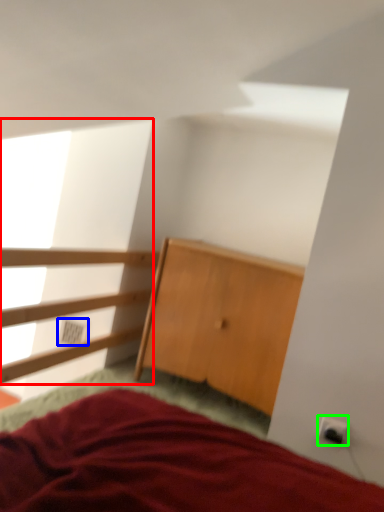
Question: Which is nearer to the window screen (highlighted by a red box)? electric outlet (highlighted by a blue box) or electric outlet (highlighted by a green box).

Choices:
 (A) electric outlet
 (B) electric outlet

Answer: (A)